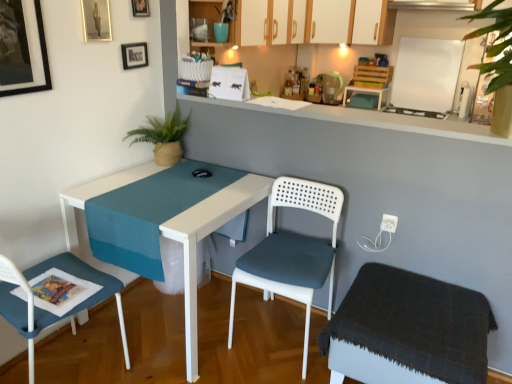
The width and height of the screenshot is (512, 384). Identify the location of vacant space that's between white plastic chair at center, which appears as the 2th chair when viewed from the left, and white plastic table at center. (242, 369).